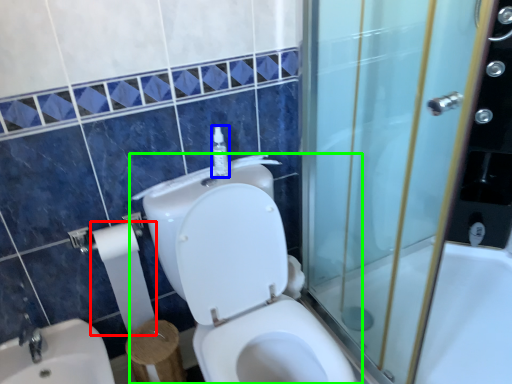
Question: Based on their relative distances, which object is farther from toilet paper (highlighted by a red box)? Choose from soap dispenser (highlighted by a blue box) and toilet (highlighted by a green box).

Choices:
 (A) soap dispenser
 (B) toilet

Answer: (A)